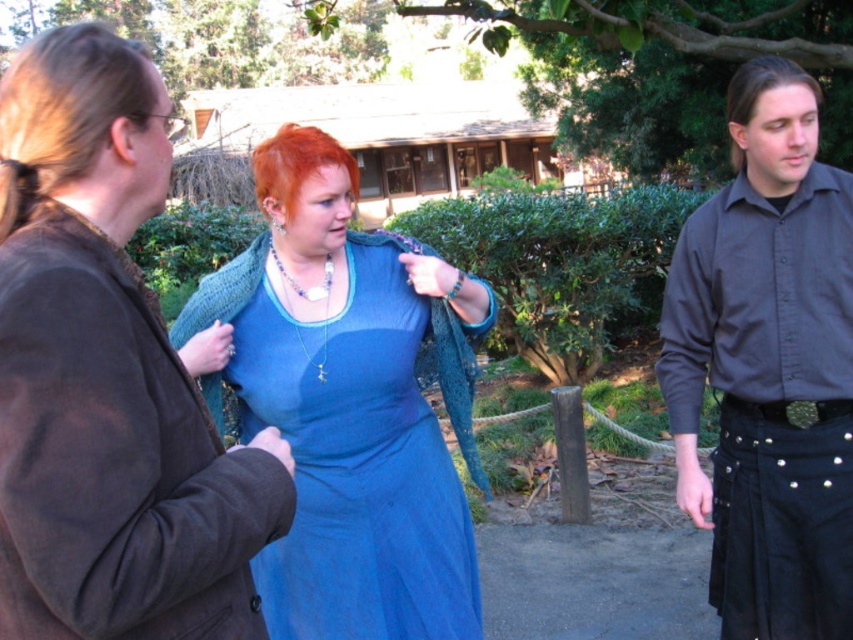
Question: Among these objects, which one is nearest to the camera?

Choices:
 (A) blonde hair at left
 (B) red dyed hair at center

Answer: (A)

Question: Is black denim kilt at lower right wider than brown straight hair at right?

Choices:
 (A) yes
 (B) no

Answer: (A)

Question: Can you confirm if matte black shirt at center is positioned to the left of brown straight hair at right?

Choices:
 (A) yes
 (B) no

Answer: (A)

Question: Does blonde hair at left appear over green metallic belt at lower right?

Choices:
 (A) yes
 (B) no

Answer: (A)

Question: Which of the following is the closest to the observer?

Choices:
 (A) brown straight hair at right
 (B) blonde hair at left
 (C) dark gray cotton shirt at right
 (D) green metallic belt at lower right

Answer: (B)

Question: Which point is farther to the camera?

Choices:
 (A) green metallic belt at lower right
 (B) knitted teal shawl at center

Answer: (A)